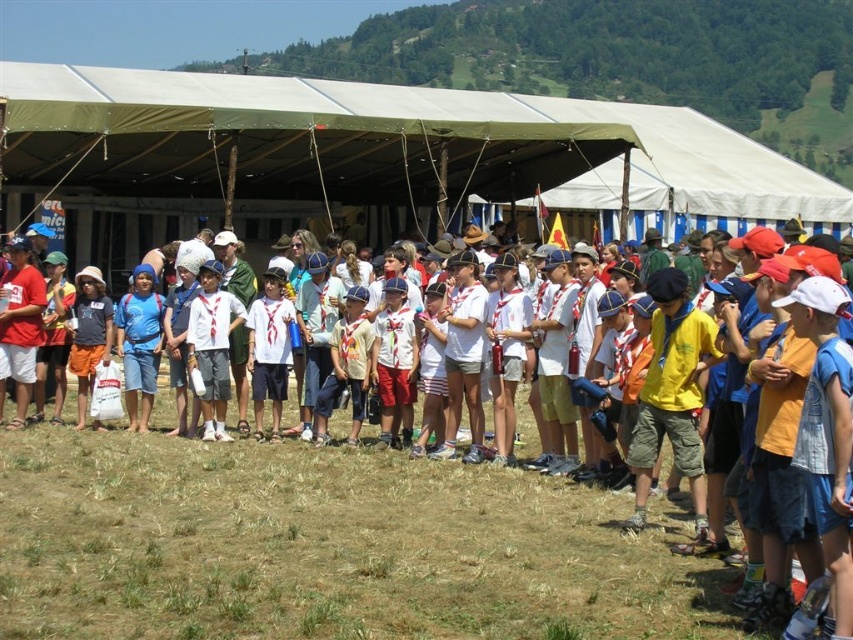
Question: Is white cotton shirt at center smaller than matte blue shorts at center?

Choices:
 (A) no
 (B) yes

Answer: (A)

Question: Which point is closer to the camera taking this photo?

Choices:
 (A) (160, 301)
 (B) (634, 593)

Answer: (B)

Question: Does white cotton shirt at center come in front of matte blue shorts at center?

Choices:
 (A) no
 (B) yes

Answer: (B)

Question: Which point appears farthest from the camera in this image?

Choices:
 (A) (236, 468)
 (B) (125, 308)

Answer: (B)

Question: Is white cotton shirt at center positioned in front of matte blue shorts at center?

Choices:
 (A) yes
 (B) no

Answer: (A)